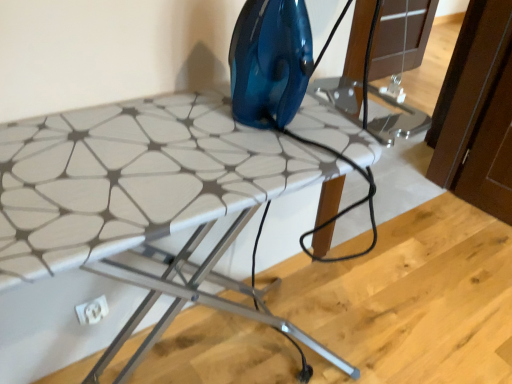
Question: Is white plastic electric outlet at lower left looking in the opposite direction of white textured ironing board at center?

Choices:
 (A) yes
 (B) no

Answer: (B)

Question: Is white plastic electric outlet at lower left positioned in front of white textured ironing board at center?

Choices:
 (A) no
 (B) yes

Answer: (A)

Question: Can you confirm if white plastic electric outlet at lower left is smaller than white textured ironing board at center?

Choices:
 (A) no
 (B) yes

Answer: (B)

Question: From a real-world perspective, is white plastic electric outlet at lower left positioned over white textured ironing board at center based on gravity?

Choices:
 (A) yes
 (B) no

Answer: (B)

Question: Considering the relative sizes of white plastic electric outlet at lower left and white textured ironing board at center in the image provided, is white plastic electric outlet at lower left taller than white textured ironing board at center?

Choices:
 (A) no
 (B) yes

Answer: (A)

Question: Is white plastic electric outlet at lower left wider than white textured ironing board at center?

Choices:
 (A) no
 (B) yes

Answer: (A)

Question: Can you confirm if white textured ironing board at center is shorter than white plastic electric outlet at lower left?

Choices:
 (A) yes
 (B) no

Answer: (B)

Question: Does white textured ironing board at center appear on the right side of white plastic electric outlet at lower left?

Choices:
 (A) yes
 (B) no

Answer: (A)

Question: Can you confirm if white textured ironing board at center is positioned to the left of white plastic electric outlet at lower left?

Choices:
 (A) yes
 (B) no

Answer: (B)

Question: From the image's perspective, is white textured ironing board at center on top of white plastic electric outlet at lower left?

Choices:
 (A) no
 (B) yes

Answer: (B)

Question: Are white textured ironing board at center and white plastic electric outlet at lower left making contact?

Choices:
 (A) yes
 (B) no

Answer: (B)

Question: Does white textured ironing board at center have a larger size compared to white plastic electric outlet at lower left?

Choices:
 (A) yes
 (B) no

Answer: (A)

Question: From a real-world perspective, is white plastic electric outlet at lower left physically located above or below white textured ironing board at center?

Choices:
 (A) above
 (B) below

Answer: (B)